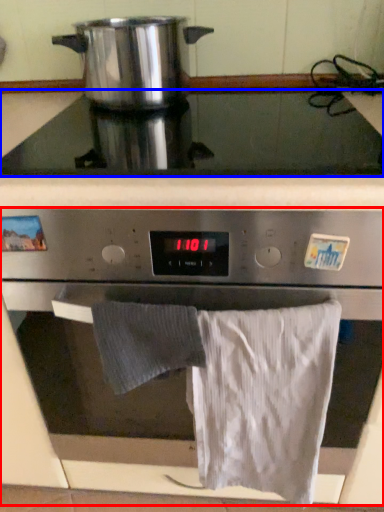
Question: Among these objects, which one is farthest to the camera, oven (highlighted by a red box) or gas stove (highlighted by a blue box)?

Choices:
 (A) oven
 (B) gas stove

Answer: (B)